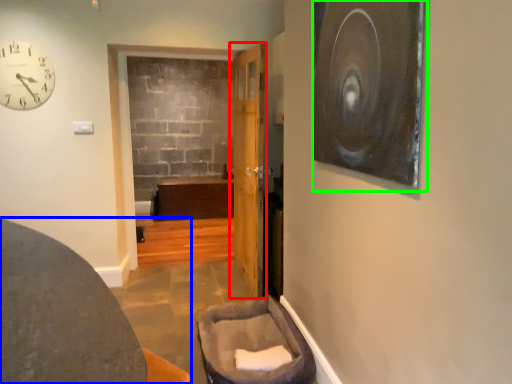
Question: Considering the real-world distances, which object is farthest from door (highlighted by a red box)? furniture (highlighted by a blue box) or picture frame (highlighted by a green box)?

Choices:
 (A) furniture
 (B) picture frame

Answer: (A)